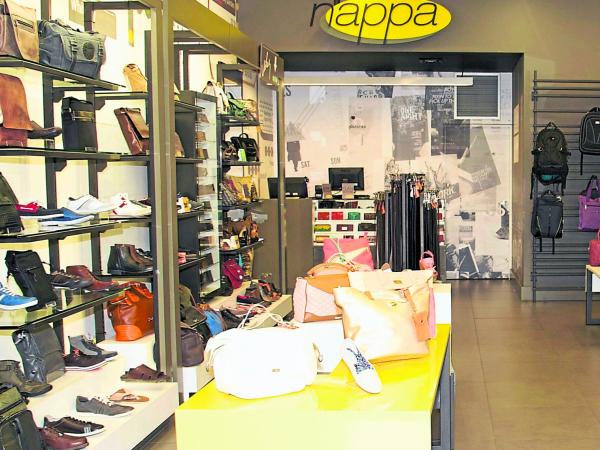
Where is `shelves`? shelves is located at coordinates (97, 295), (57, 232), (56, 153).